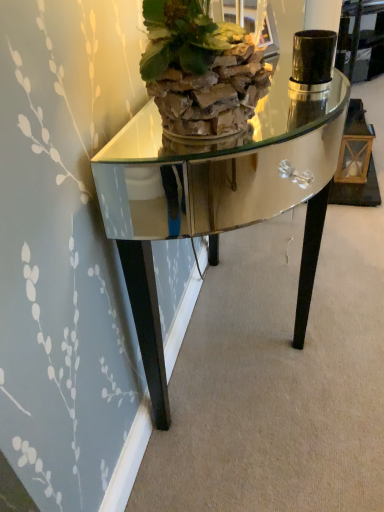
Question: Is green leafy plant at upper center looking in the opposite direction of shiny mirrored table at center?

Choices:
 (A) yes
 (B) no

Answer: (B)

Question: Is green leafy plant at upper center facing towards shiny mirrored table at center?

Choices:
 (A) no
 (B) yes

Answer: (A)

Question: Does green leafy plant at upper center have a greater height compared to shiny mirrored table at center?

Choices:
 (A) no
 (B) yes

Answer: (A)

Question: Would you consider green leafy plant at upper center to be distant from shiny mirrored table at center?

Choices:
 (A) no
 (B) yes

Answer: (B)

Question: Is green leafy plant at upper center thinner than shiny mirrored table at center?

Choices:
 (A) yes
 (B) no

Answer: (A)

Question: From the image's perspective, is green leafy plant at upper center below shiny mirrored table at center?

Choices:
 (A) yes
 (B) no

Answer: (B)

Question: From the image's perspective, is shiny mirrored table at center above green leafy plant at upper center?

Choices:
 (A) yes
 (B) no

Answer: (B)

Question: Can you confirm if shiny mirrored table at center is positioned to the left of green leafy plant at upper center?

Choices:
 (A) yes
 (B) no

Answer: (B)

Question: Are shiny mirrored table at center and green leafy plant at upper center making contact?

Choices:
 (A) yes
 (B) no

Answer: (B)

Question: Considering the relative sizes of shiny mirrored table at center and green leafy plant at upper center in the image provided, is shiny mirrored table at center bigger than green leafy plant at upper center?

Choices:
 (A) yes
 (B) no

Answer: (A)

Question: Is shiny mirrored table at center to the right of green leafy plant at upper center from the viewer's perspective?

Choices:
 (A) yes
 (B) no

Answer: (A)

Question: Is shiny mirrored table at center in front of green leafy plant at upper center?

Choices:
 (A) yes
 (B) no

Answer: (B)

Question: In terms of width, does green leafy plant at upper center look wider or thinner when compared to shiny mirrored table at center?

Choices:
 (A) wide
 (B) thin

Answer: (B)